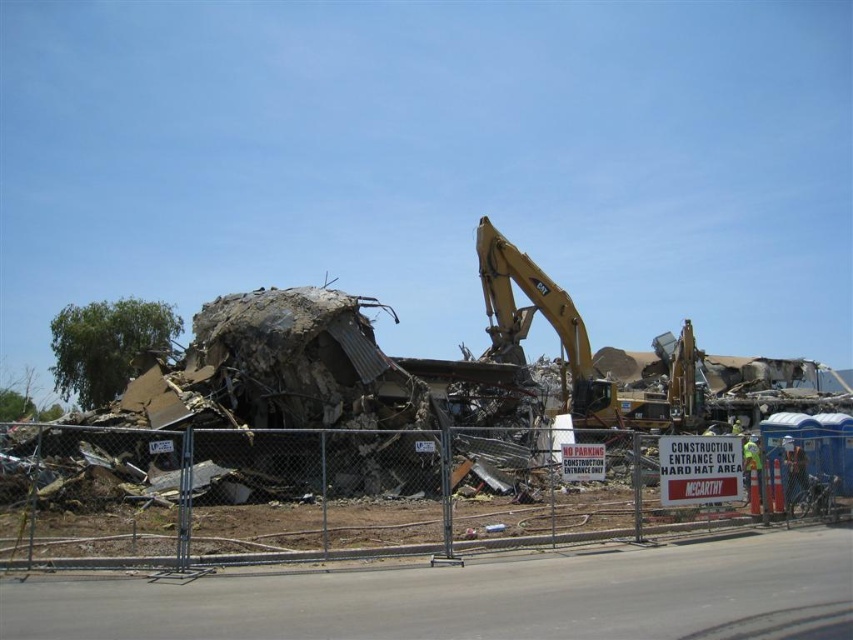
Between metal chain-link fence at center and yellow metallic excavator at center, which one is positioned higher?

yellow metallic excavator at center

Is metal chain-link fence at center behind yellow metallic excavator at center?

No, metal chain-link fence at center is closer to the viewer.

Identify the location of metal chain-link fence at center. (306, 497).